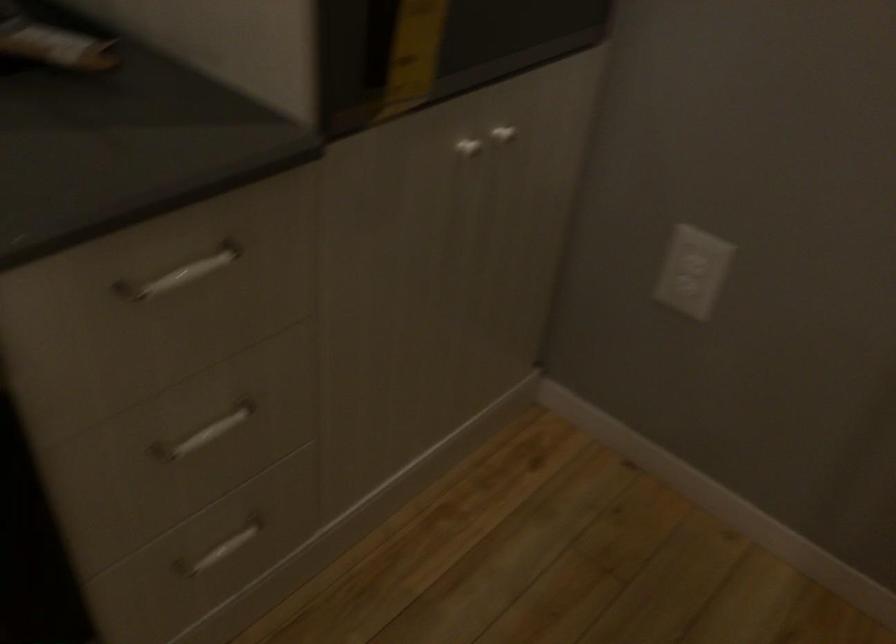
Question: How did the camera likely rotate?

Choices:
 (A) Left
 (B) Right
 (C) Up
 (D) Down

Answer: (B)